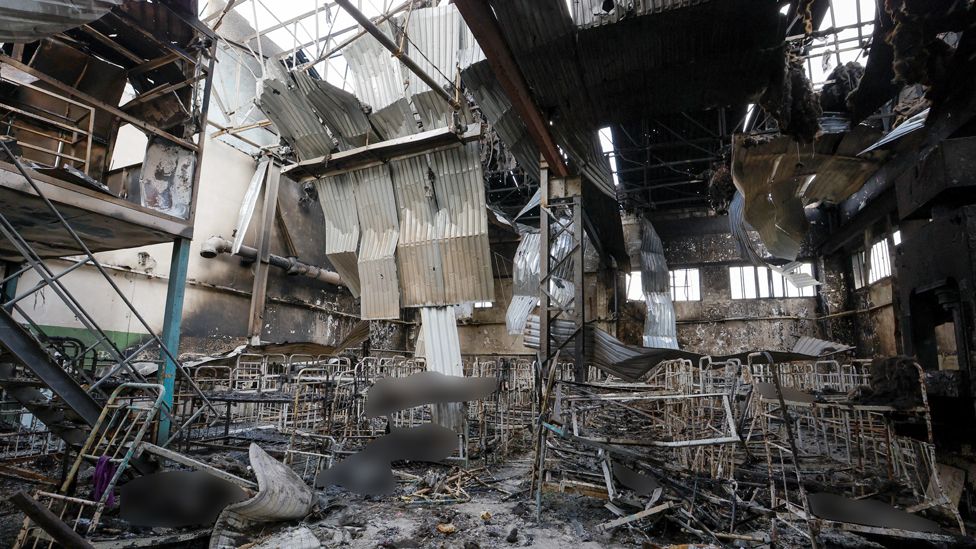
At what (x,y) coordinates should I click in order to perform the action: click on green wall. Please return your answer as a coordinate pair (x, y). Image resolution: width=976 pixels, height=549 pixels. Looking at the image, I should click on (118, 336).